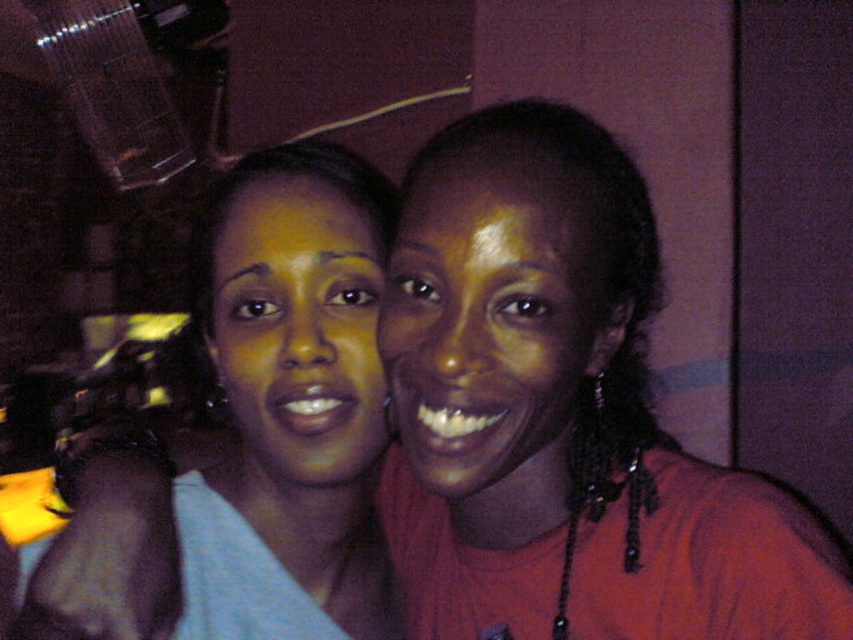
You are a photographer trying to focus on the matte gold face at center. Where should you point your camera to capture it precisely?

You should point your camera to coordinates point (491,323) to capture the matte gold face at center precisely.

You are a photographer trying to adjust the lighting for a portrait. You notice the matte red shirt at center and the matte gold face at center in your frame. Which object is located to the right of the other?

The matte red shirt at center is positioned on the right side of matte gold face at center.

You are a photographer trying to adjust the lighting for a group photo. You notice two faces in the center of the image, a matte gold face at center and a matte yellow face at center. Which face is located lower in the frame?

The matte gold face at center is positioned under the matte yellow face at center, so it is lower in the frame.